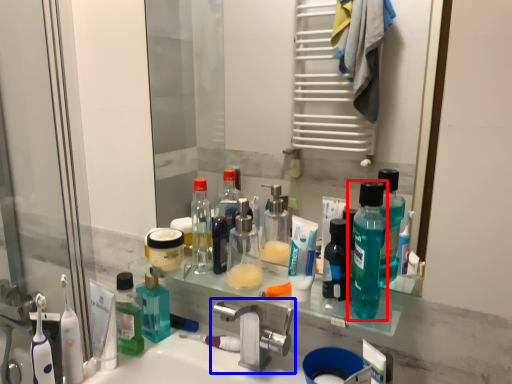
Question: Which object appears farthest to the camera in this image, bottle (highlighted by a red box) or tap (highlighted by a blue box)?

Choices:
 (A) bottle
 (B) tap

Answer: (B)